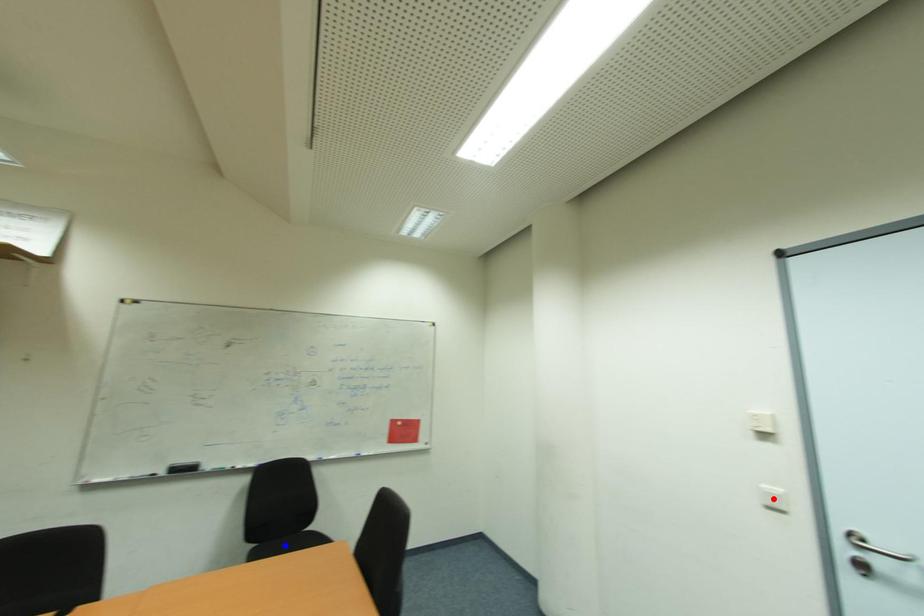
Question: Which of the two points in the image is closer to the camera?

Choices:
 (A) Blue point is closer.
 (B) Red point is closer.

Answer: (B)